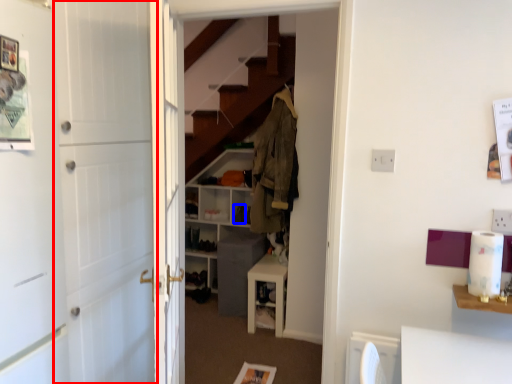
Question: Which object is closer to the camera taking this photo, barn door (highlighted by a red box) or shoe (highlighted by a blue box)?

Choices:
 (A) barn door
 (B) shoe

Answer: (A)